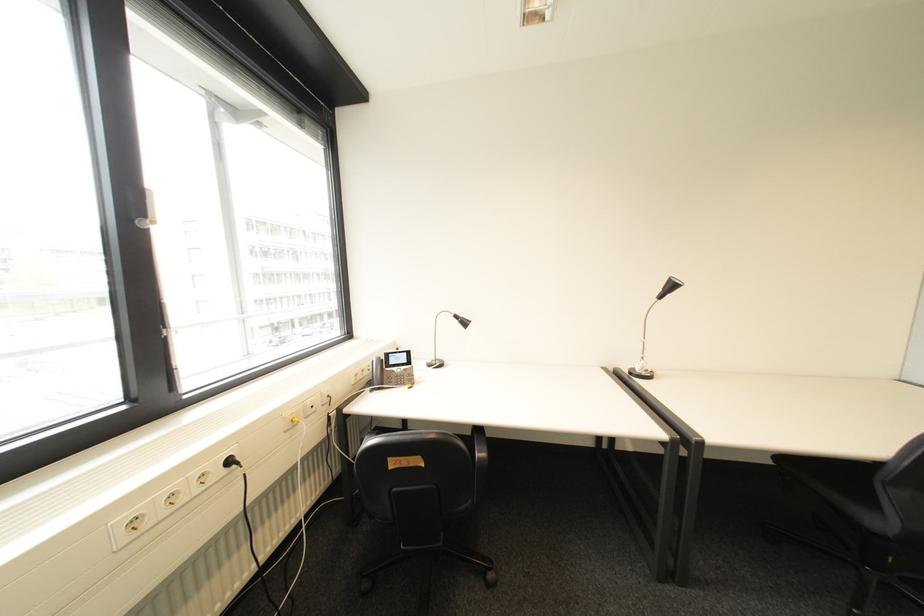
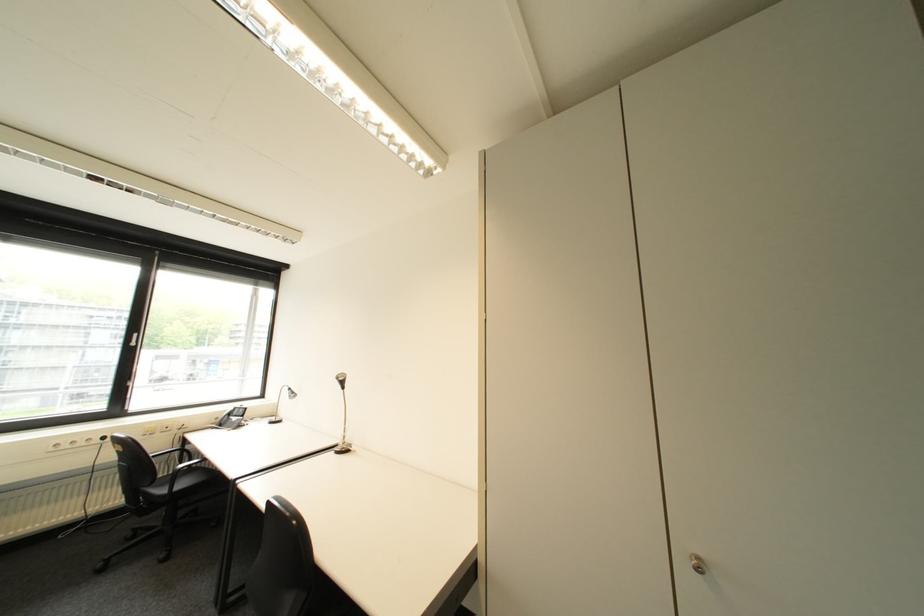
Where in the second image is the point corresponding to point 239,463 from the first image?

(114, 439)